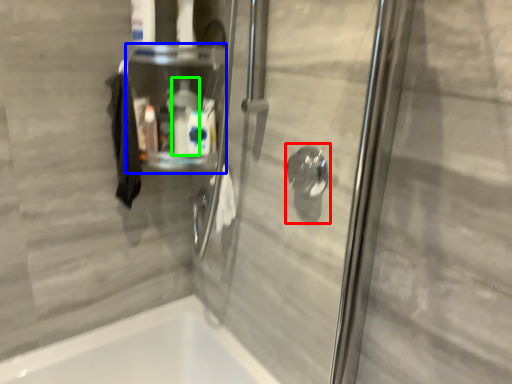
Question: Based on their relative distances, which object is farther from shower (highlighted by a red box)? Choose from shelf (highlighted by a blue box) and cleaning product (highlighted by a green box).

Choices:
 (A) shelf
 (B) cleaning product

Answer: (A)